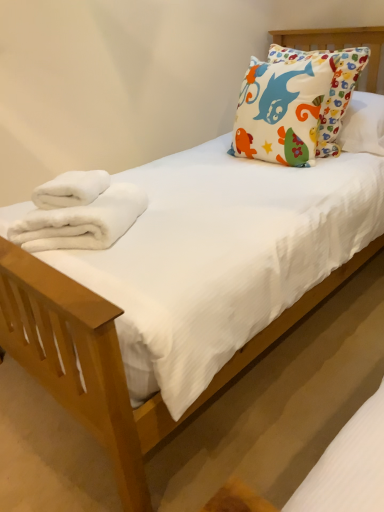
The width and height of the screenshot is (384, 512). Describe the element at coordinates (282, 111) in the screenshot. I see `multicolored fabric pillow at upper right` at that location.

Describe the element at coordinates (82, 222) in the screenshot. The height and width of the screenshot is (512, 384). I see `white fluffy towels at lower left, the first bath towel ordered from the bottom` at that location.

This screenshot has width=384, height=512. What do you see at coordinates (71, 189) in the screenshot?
I see `white fluffy towel at left, which is the second bath towel in bottom-to-top order` at bounding box center [71, 189].

Locate an element on the screen. This screenshot has width=384, height=512. multicolored fabric pillow at upper right is located at coordinates (282, 111).

Which object is closer to the camera taking this photo, white fluffy towels at lower left, the first bath towel ordered from the bottom, or white fluffy towel at left, the 1th bath towel in the top-to-bottom sequence?

Positioned in front is white fluffy towels at lower left, the first bath towel ordered from the bottom.

Would you consider white fluffy towels at lower left, the first bath towel ordered from the bottom, to be distant from white fluffy towel at left, the 1th bath towel in the top-to-bottom sequence?

No, white fluffy towels at lower left, the first bath towel ordered from the bottom, is in close proximity to white fluffy towel at left, the 1th bath towel in the top-to-bottom sequence.

Does point (123, 199) lie in front of point (92, 192)?

That is True.

Considering the sizes of objects white fluffy towels at lower left, the first bath towel ordered from the bottom, and white fluffy towel at left, the 1th bath towel in the top-to-bottom sequence, in the image provided, who is smaller, white fluffy towels at lower left, the first bath towel ordered from the bottom, or white fluffy towel at left, the 1th bath towel in the top-to-bottom sequence,?

With smaller size is white fluffy towel at left, the 1th bath towel in the top-to-bottom sequence.

The height and width of the screenshot is (512, 384). In order to click on bath towel that appears below the white fluffy towel at left, the 1th bath towel in the top-to-bottom sequence (from the image's perspective) in this screenshot , I will do `click(82, 222)`.

Based on the photo, is the position of white fluffy towel at left, which is the second bath towel in bottom-to-top order, less distant than that of white fluffy towels at lower left, which appears as the second bath towel when viewed from the top?

That is False.

In the scene shown: Would you say white fluffy towel at left, the 1th bath towel in the top-to-bottom sequence, is to the left or to the right of white fluffy towels at lower left, the first bath towel ordered from the bottom, in the picture?

In the image, white fluffy towel at left, the 1th bath towel in the top-to-bottom sequence, appears on the left side of white fluffy towels at lower left, the first bath towel ordered from the bottom.

Could white fluffy towels at lower left, the first bath towel ordered from the bottom, be considered to be inside white fluffy towel at left, the 1th bath towel in the top-to-bottom sequence?

No, white fluffy towel at left, the 1th bath towel in the top-to-bottom sequence, does not contain white fluffy towels at lower left, the first bath towel ordered from the bottom.

Is white fluffy towel at left, which is the second bath towel in bottom-to-top order, inside multicolored fabric pillow at upper right?

No.

Can you tell me how much multicolored fabric pillow at upper right and white fluffy towel at left, which is the second bath towel in bottom-to-top order, differ in facing direction?

35.4 degrees separate the facing orientations of multicolored fabric pillow at upper right and white fluffy towel at left, which is the second bath towel in bottom-to-top order.

Which object is wider, multicolored fabric pillow at upper right or white fluffy towel at left, which is the second bath towel in bottom-to-top order?

With larger width is multicolored fabric pillow at upper right.

Considering the relative sizes of multicolored fabric pillow at upper right and white fluffy towel at left, the 1th bath towel in the top-to-bottom sequence, in the image provided, is multicolored fabric pillow at upper right bigger than white fluffy towel at left, the 1th bath towel in the top-to-bottom sequence,?

Indeed, multicolored fabric pillow at upper right has a larger size compared to white fluffy towel at left, the 1th bath towel in the top-to-bottom sequence.

Is multicolored fabric pillow at upper right at the left side of white fluffy towels at lower left, the first bath towel ordered from the bottom?

In fact, multicolored fabric pillow at upper right is to the right of white fluffy towels at lower left, the first bath towel ordered from the bottom.

From a real-world perspective, which is physically above, multicolored fabric pillow at upper right or white fluffy towels at lower left, the first bath towel ordered from the bottom?

In real-world perspective, multicolored fabric pillow at upper right is above.

Find the location of a particular element. bath towel that is the 2nd object directly below the multicolored fabric pillow at upper right (from a real-world perspective) is located at coordinates (82, 222).

From the image's perspective, is white fluffy towels at lower left, which appears as the second bath towel when viewed from the top, under multicolored fabric pillow at upper right?

Yes, from the image's perspective, white fluffy towels at lower left, which appears as the second bath towel when viewed from the top, is below multicolored fabric pillow at upper right.

Is point (32, 233) closer to viewer compared to point (258, 92)?

Yes, point (32, 233) is in front of point (258, 92).

Is white fluffy towels at lower left, the first bath towel ordered from the bottom, wider or thinner than multicolored fabric pillow at upper right?

Considering their sizes, white fluffy towels at lower left, the first bath towel ordered from the bottom, looks broader than multicolored fabric pillow at upper right.

From a real-world perspective, does white fluffy towels at lower left, which appears as the second bath towel when viewed from the top, sit lower than multicolored fabric pillow at upper right?

Yes, from a real-world perspective, white fluffy towels at lower left, which appears as the second bath towel when viewed from the top, is beneath multicolored fabric pillow at upper right.

Considering the sizes of white fluffy towel at left, the 1th bath towel in the top-to-bottom sequence, and multicolored fabric pillow at upper right in the image, is white fluffy towel at left, the 1th bath towel in the top-to-bottom sequence, bigger or smaller than multicolored fabric pillow at upper right?

In the image, white fluffy towel at left, the 1th bath towel in the top-to-bottom sequence, appears to be smaller than multicolored fabric pillow at upper right.

Considering the positions of point (84, 176) and point (311, 79), is point (84, 176) closer or farther from the camera than point (311, 79)?

Point (84, 176) is positioned closer to the camera compared to point (311, 79).

Can you confirm if white fluffy towel at left, which is the second bath towel in bottom-to-top order, is shorter than multicolored fabric pillow at upper right?

Yes.

Based on their positions, is white fluffy towel at left, the 1th bath towel in the top-to-bottom sequence, located to the left or right of multicolored fabric pillow at upper right?

white fluffy towel at left, the 1th bath towel in the top-to-bottom sequence, is positioned on multicolored fabric pillow at upper right's left side.

You are a GUI agent. You are given a task and a screenshot of the screen. Output one action in this format:
    pyautogui.click(x=<x>, y=<y>)
    Task: Click on the bath towel located in front of the white fluffy towel at left, which is the second bath towel in bottom-to-top order
    Image resolution: width=384 pixels, height=512 pixels.
    Given the screenshot: What is the action you would take?
    (82, 222)

Identify the location of bath towel above the white fluffy towels at lower left, the first bath towel ordered from the bottom (from the image's perspective). The height and width of the screenshot is (512, 384). (71, 189).

Which object lies further to the anchor point white fluffy towels at lower left, which appears as the second bath towel when viewed from the top, white fluffy towel at left, which is the second bath towel in bottom-to-top order, or multicolored fabric pillow at upper right?

The object further to white fluffy towels at lower left, which appears as the second bath towel when viewed from the top, is multicolored fabric pillow at upper right.

From the image, which object appears to be farther from multicolored fabric pillow at upper right, white fluffy towel at left, the 1th bath towel in the top-to-bottom sequence, or white fluffy towels at lower left, which appears as the second bath towel when viewed from the top?

white fluffy towels at lower left, which appears as the second bath towel when viewed from the top, lies further to multicolored fabric pillow at upper right than the other object.

When comparing their distances from white fluffy towels at lower left, the first bath towel ordered from the bottom, does multicolored fabric pillow at upper right or white fluffy towel at left, the 1th bath towel in the top-to-bottom sequence, seem further?

Based on the image, multicolored fabric pillow at upper right appears to be further to white fluffy towels at lower left, the first bath towel ordered from the bottom.

Looking at the image, which one is located further to multicolored fabric pillow at upper right, white fluffy towels at lower left, the first bath towel ordered from the bottom, or white fluffy towel at left, which is the second bath towel in bottom-to-top order?

Based on the image, white fluffy towels at lower left, the first bath towel ordered from the bottom, appears to be further to multicolored fabric pillow at upper right.

Considering their positions, is white fluffy towels at lower left, which appears as the second bath towel when viewed from the top, positioned further to white fluffy towel at left, the 1th bath towel in the top-to-bottom sequence, than multicolored fabric pillow at upper right?

multicolored fabric pillow at upper right is further to white fluffy towel at left, the 1th bath towel in the top-to-bottom sequence.

Estimate the real-world distances between objects in this image. Which object is further from white fluffy towel at left, the 1th bath towel in the top-to-bottom sequence, multicolored fabric pillow at upper right or white fluffy towels at lower left, which appears as the second bath towel when viewed from the top?

Based on the image, multicolored fabric pillow at upper right appears to be further to white fluffy towel at left, the 1th bath towel in the top-to-bottom sequence.

What are the coordinates of `bath towel between white fluffy towel at left, the 1th bath towel in the top-to-bottom sequence, and multicolored fabric pillow at upper right, in the horizontal direction` in the screenshot? It's located at (82, 222).